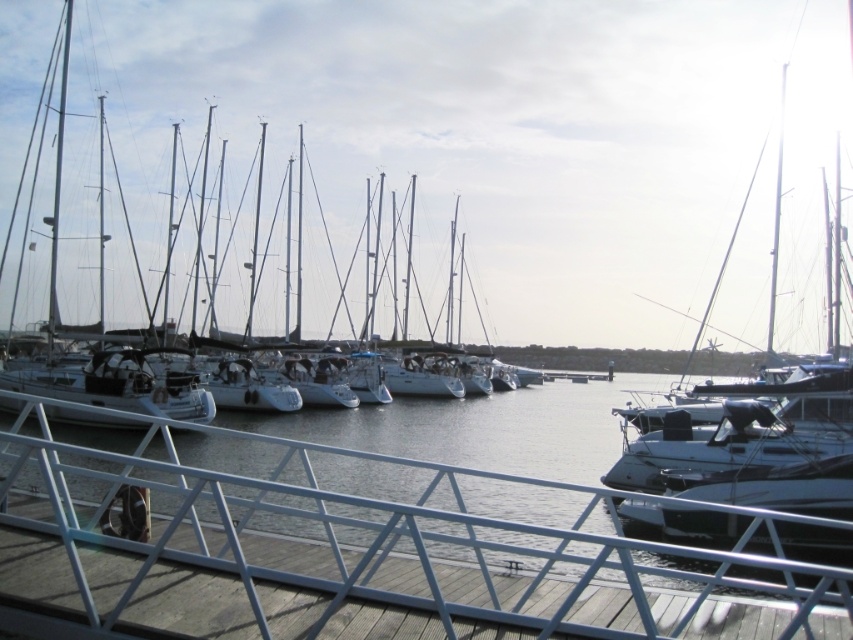
Is white glossy sailboat at center shorter than white metal rail at lower center?

In fact, white glossy sailboat at center may be taller than white metal rail at lower center.

What do you see at coordinates (453, 147) in the screenshot? This screenshot has height=640, width=853. I see `white glossy sailboat at center` at bounding box center [453, 147].

What do you see at coordinates (453, 147) in the screenshot?
I see `white glossy sailboat at center` at bounding box center [453, 147].

What are the coordinates of `white glossy sailboat at center` in the screenshot? It's located at (453, 147).